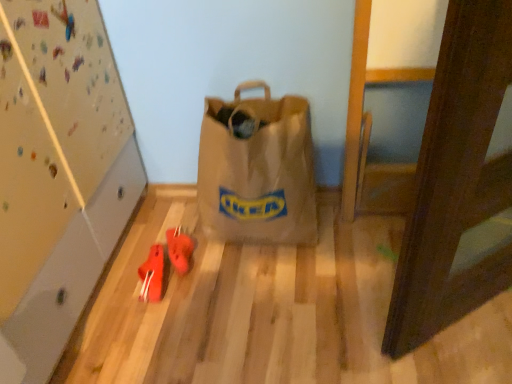
The image size is (512, 384). I want to click on vacant area in front of rubberized red shoes at lower left, acting as the 2th footwear starting from the right, so click(x=144, y=329).